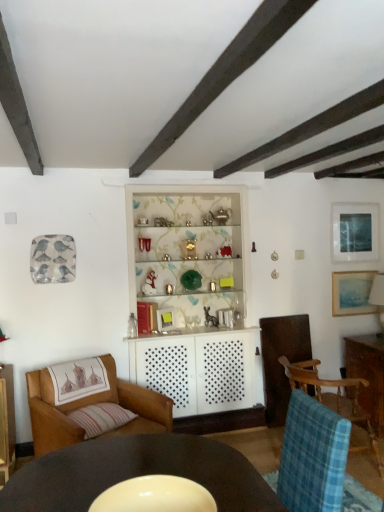
Question: Can you confirm if striped fabric pillow at lower left is wider than matte blue painting at upper right, arranged as the 1th picture frame when ordered from the bottom?

Choices:
 (A) no
 (B) yes

Answer: (B)

Question: Is striped fabric pillow at lower left smaller than matte blue painting at upper right, which is the second picture frame from top to bottom?

Choices:
 (A) no
 (B) yes

Answer: (A)

Question: Considering the relative positions of striped fabric pillow at lower left and matte blue painting at upper right, which is the second picture frame from top to bottom, in the image provided, is striped fabric pillow at lower left in front of matte blue painting at upper right, which is the second picture frame from top to bottom,?

Choices:
 (A) no
 (B) yes

Answer: (B)

Question: Is striped fabric pillow at lower left aimed at matte blue painting at upper right, which is the second picture frame from top to bottom?

Choices:
 (A) no
 (B) yes

Answer: (A)

Question: Is the position of striped fabric pillow at lower left more distant than that of matte blue painting at upper right, arranged as the 1th picture frame when ordered from the bottom?

Choices:
 (A) no
 (B) yes

Answer: (A)

Question: In terms of width, does blue plaid fabric chair at lower right, which is the 2th chair from left to right, look wider or thinner when compared to white textured cabinet at center?

Choices:
 (A) wide
 (B) thin

Answer: (A)

Question: Do you think blue plaid fabric chair at lower right, the first chair in the right-to-left sequence, is within white textured cabinet at center, or outside of it?

Choices:
 (A) outside
 (B) inside

Answer: (A)

Question: Is blue plaid fabric chair at lower right, the first chair in the right-to-left sequence, bigger or smaller than white textured cabinet at center?

Choices:
 (A) big
 (B) small

Answer: (B)

Question: In terms of height, does blue plaid fabric chair at lower right, which is the 2th chair from left to right, look taller or shorter compared to white textured cabinet at center?

Choices:
 (A) short
 (B) tall

Answer: (A)

Question: Is striped fabric pillow at lower left wider or thinner than matte blue painting at upper right, which is the second picture frame from top to bottom?

Choices:
 (A) thin
 (B) wide

Answer: (B)

Question: From their relative heights in the image, would you say striped fabric pillow at lower left is taller or shorter than matte blue painting at upper right, which is the second picture frame from top to bottom?

Choices:
 (A) short
 (B) tall

Answer: (A)

Question: From a real-world perspective, is striped fabric pillow at lower left positioned above or below matte blue painting at upper right, which is the second picture frame from top to bottom?

Choices:
 (A) above
 (B) below

Answer: (B)

Question: Which is correct: striped fabric pillow at lower left is inside matte blue painting at upper right, arranged as the 1th picture frame when ordered from the bottom, or outside of it?

Choices:
 (A) outside
 (B) inside

Answer: (A)

Question: Is smooth dark wood table at lower center situated inside brown leather chair at lower left, placed as the second chair when sorted from right to left, or outside?

Choices:
 (A) inside
 (B) outside

Answer: (B)

Question: In terms of height, does smooth dark wood table at lower center look taller or shorter compared to brown leather chair at lower left, placed as the second chair when sorted from right to left?

Choices:
 (A) short
 (B) tall

Answer: (A)